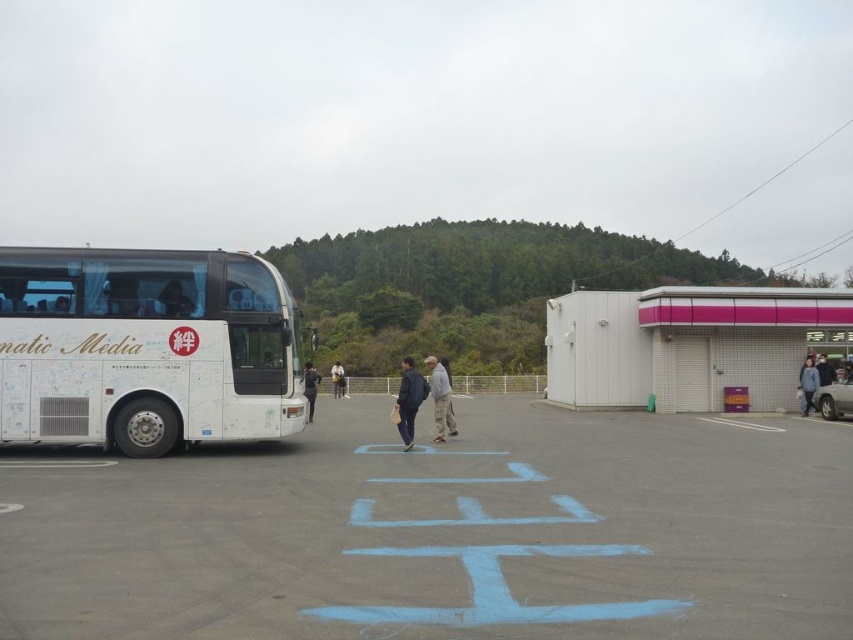
You are standing at the parking lot and want to walk towards the bus. There are two points marked on the ground in front of you. One is at point (x=399, y=420) and the other is at point (x=312, y=376). Which point is closer to you as you face the bus?

Point (x=399, y=420) is closer to you than point (x=312, y=376).

You are a delivery person who needs to park your van in the white asphalt parking lot at center. The van is 2 meters wide. Can you fit your van into the parking lot if the white matte bus at left is already occupying part of it?

The white asphalt parking lot at center is wider than the white matte bus at left, so yes, the van can fit into the parking lot as there is enough space remaining after accounting for the bus.

In the scene shown: You are a photographer trying to capture both the dark blue fabric jacket at center and the black fabric jacket at center in a single frame. Since you want both jackets to appear clearly, which jacket should you focus on to ensure the larger one is in sharp focus?

The dark blue fabric jacket at center is larger than the black fabric jacket at center, so focusing on the dark blue fabric jacket at center will ensure it is in sharp focus while the smaller black fabric jacket at center will also be in focus due to depth of field.